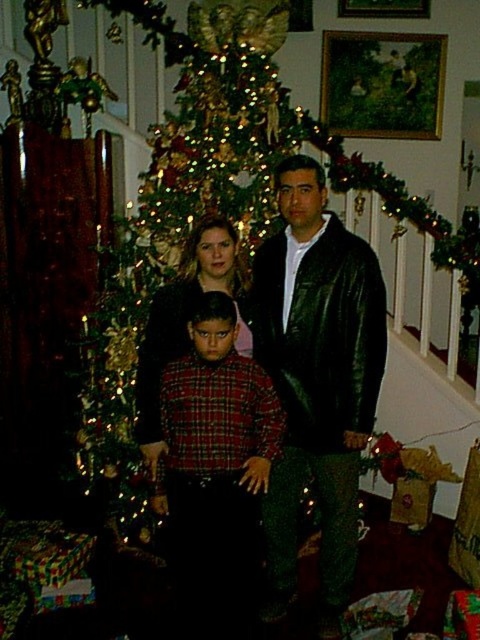
You are a photographer trying to capture a photo of the family without any obstructions. The shiny black leather jacket at center and the wooden framed painting at upper center are in the way. Which object should you move to ensure the painting is visible in the photo?

You should move the shiny black leather jacket at center because it is taller than the wooden framed painting at upper center and is blocking the view of the painting.

You are a photographer standing at the camera position. You want to take a closeup photo of the plaid shirt at center. The camera has a minimum focusing distance of 5 feet. Can you take the photo without moving the subject?

The plaid shirt at center is 7.84 feet from camera, which is beyond the minimum focusing distance of 5 feet. Therefore, you can take the photo without moving the subject.

You are a photographer trying to capture a photo of the family. You notice the plaid shirt at center and the wooden framed painting at upper center are both in the frame. Which object is positioned closer to the camera?

The plaid shirt at center is closer to the viewer than the wooden framed painting at upper center, so it is positioned closer to the camera.